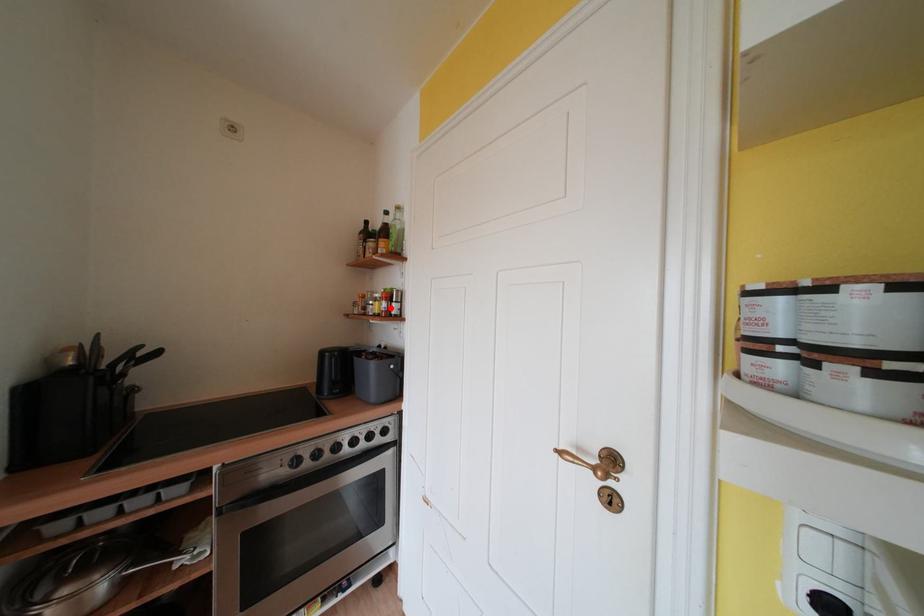
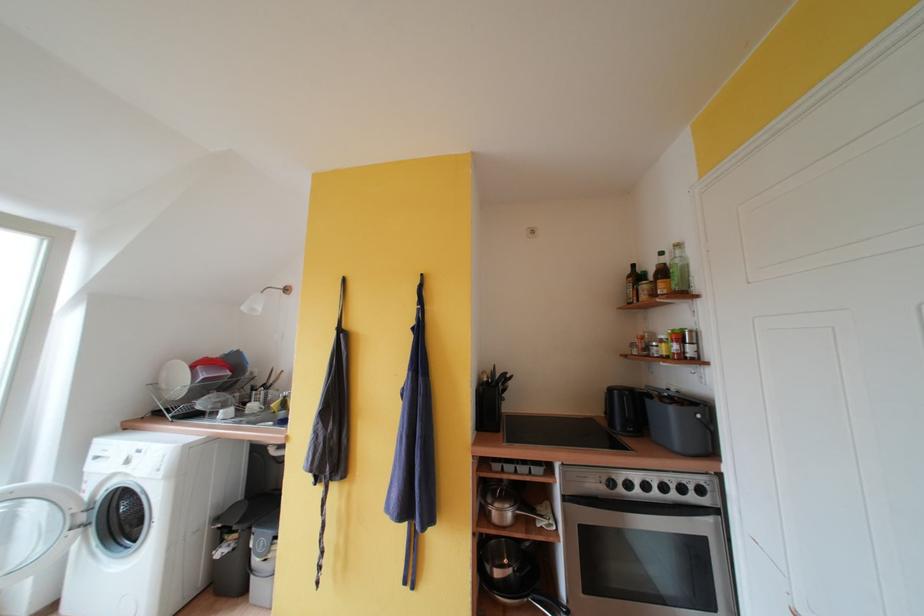
Find the pixel in the second image that matches the highlighted location in the first image.

(682, 350)